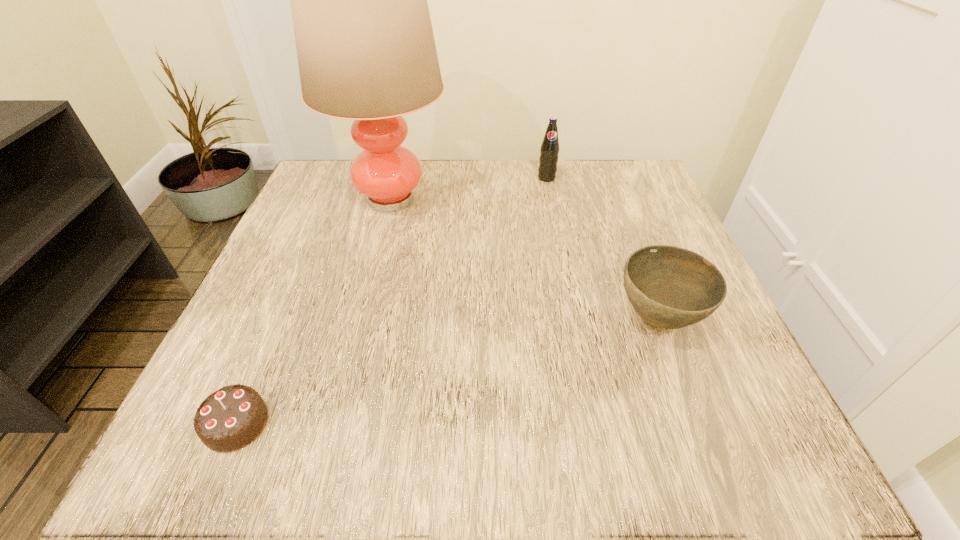
Identify the location of vacant space located on the back of the chocolate cake. The width and height of the screenshot is (960, 540). (284, 312).

The image size is (960, 540). Identify the location of lamp at the far edge. (366, 52).

The height and width of the screenshot is (540, 960). I want to click on pop at the far edge, so click(x=549, y=150).

In order to click on object that is at the near edge in this screenshot , I will do `click(229, 419)`.

The height and width of the screenshot is (540, 960). I want to click on lamp present at the left edge, so click(x=366, y=52).

Image resolution: width=960 pixels, height=540 pixels. Identify the location of chocolate cake present at the left edge. (229, 419).

Find the location of `object positioned at the right edge`. object positioned at the right edge is located at coordinates (669, 287).

In order to click on object at the far left corner in this screenshot , I will do `click(366, 52)`.

The width and height of the screenshot is (960, 540). In order to click on object that is positioned at the near left corner in this screenshot , I will do `click(229, 419)`.

Where is `vacant area at the far edge of the desktop`? This screenshot has height=540, width=960. vacant area at the far edge of the desktop is located at coordinates (481, 168).